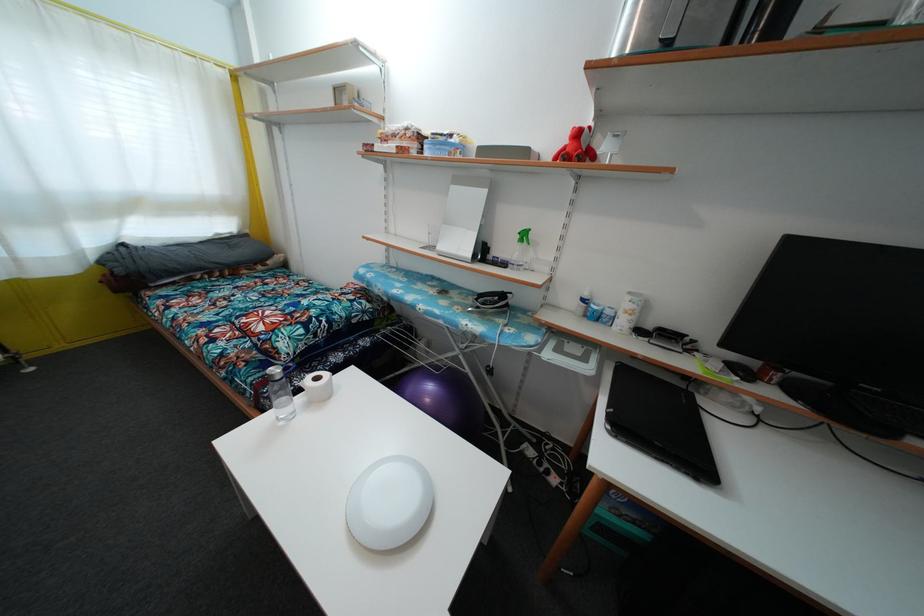
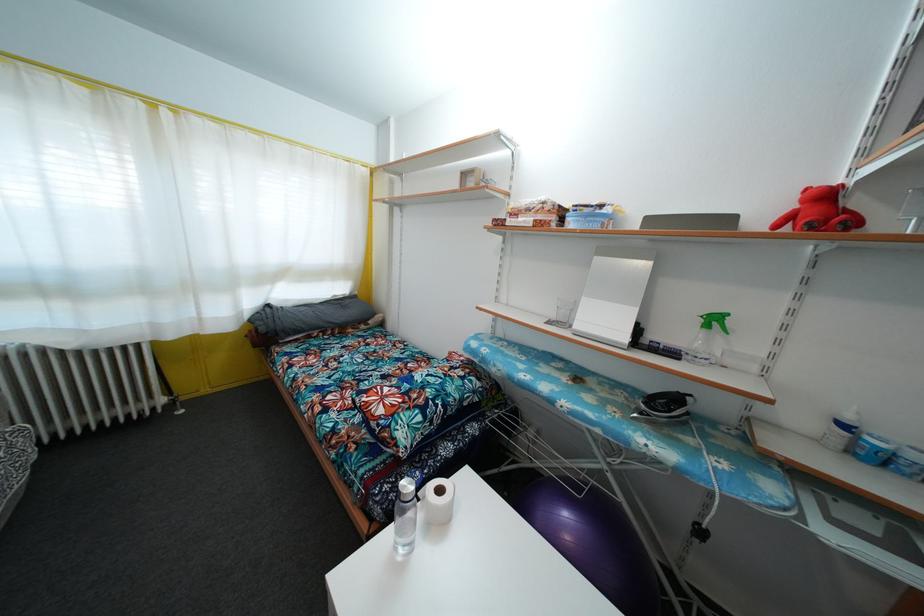
Find the pixel in the second image that matches (250,238) in the first image.

(359, 300)